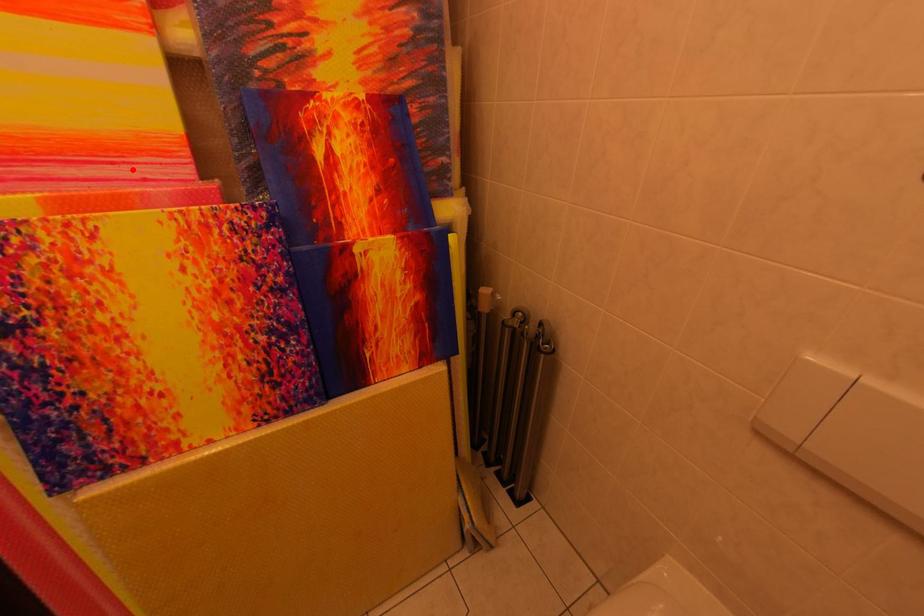
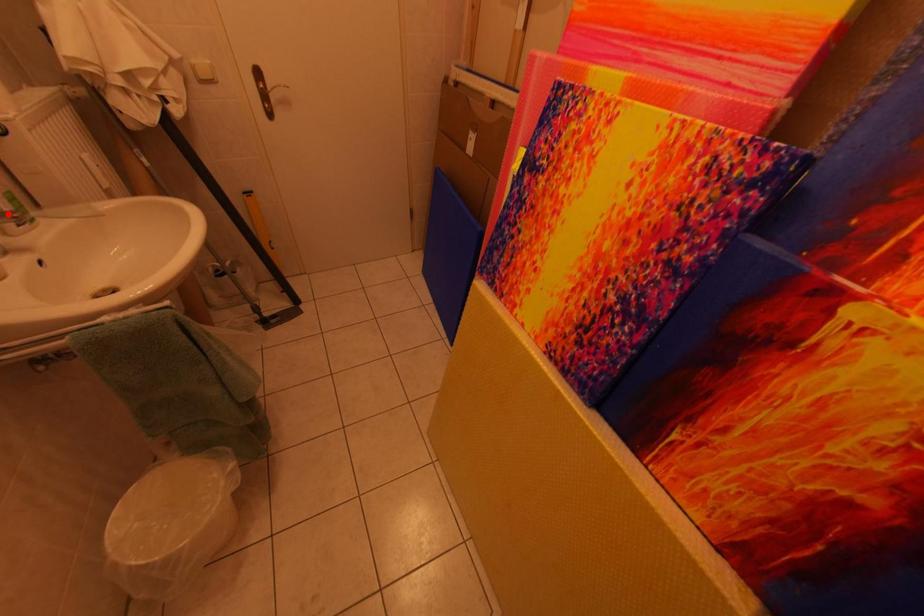
I am providing you with two images of the same scene from different viewpoints. A red point is marked on the first image and another point is marked on the second image. Are the points marked in image1 and image2 representing the same 3D position?

No